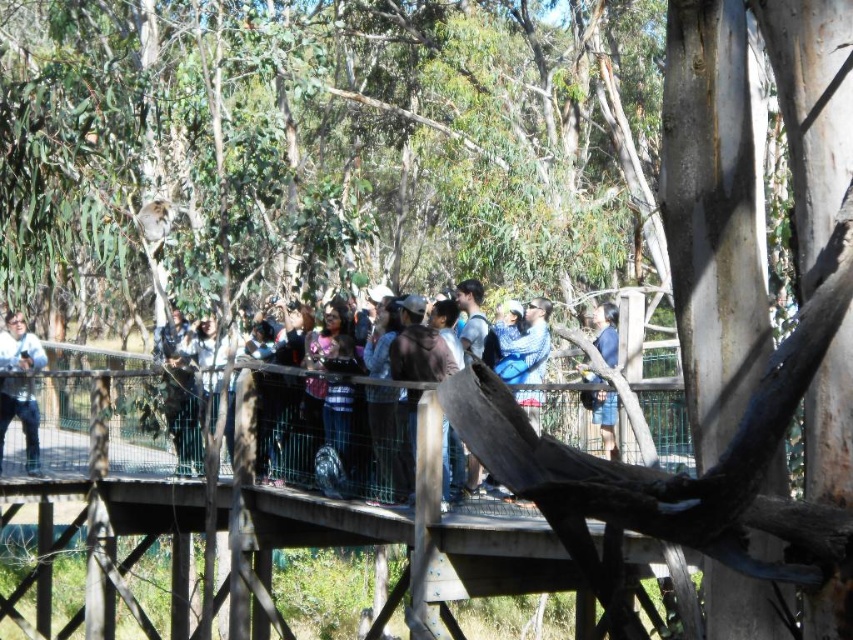
Question: Does wooden bridge at center appear under blue denim shorts at center?

Choices:
 (A) no
 (B) yes

Answer: (B)

Question: Which is farther from the dark blue shirt at center?

Choices:
 (A) dark blue jeans at center
 (B) matte black jacket at center
 (C) matte blue jeans at left

Answer: (C)

Question: Can you confirm if matte black jacket at center is positioned to the left of blue denim shorts at center?

Choices:
 (A) yes
 (B) no

Answer: (A)

Question: Can you confirm if dark blue shirt at center is positioned to the right of matte blue jeans at left?

Choices:
 (A) yes
 (B) no

Answer: (A)

Question: Estimate the real-world distances between objects in this image. Which object is closer to the dark blue shirt at center?

Choices:
 (A) dark blue jeans at center
 (B) matte blue jeans at left
 (C) blue denim shorts at center

Answer: (A)

Question: Which point is closer to the camera?

Choices:
 (A) matte blue jeans at left
 (B) matte black jacket at center
 (C) dark blue shirt at center

Answer: (C)